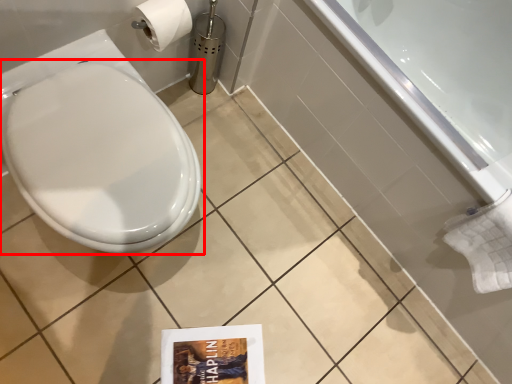
Question: From the image's perspective, what is the correct spatial relationship of toilet (annotated by the red box) in relation to bath?

Choices:
 (A) below
 (B) above

Answer: (A)